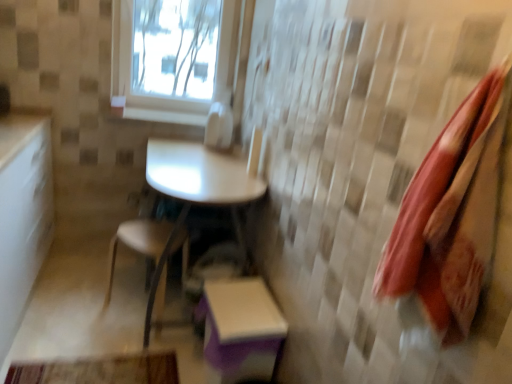
Question: Based on their sizes in the image, would you say purple matte step stool at lower center is bigger or smaller than white glossy window sill at upper center?

Choices:
 (A) big
 (B) small

Answer: (A)

Question: Relative to white glossy window sill at upper center, is purple matte step stool at lower center in front or behind?

Choices:
 (A) front
 (B) behind

Answer: (A)

Question: Which object is positioned closest to the red fabric towel at right?

Choices:
 (A) transparent glass window at upper center
 (B) metallic silver chair at center
 (C) purple matte step stool at lower center
 (D) white glossy table at center
 (E) white glossy window sill at upper center

Answer: (C)

Question: Based on their relative distances, which object is farther from the transparent glass window at upper center?

Choices:
 (A) red fabric towel at right
 (B) white glossy table at center
 (C) white glossy window sill at upper center
 (D) purple matte step stool at lower center
 (E) metallic silver chair at center

Answer: (A)